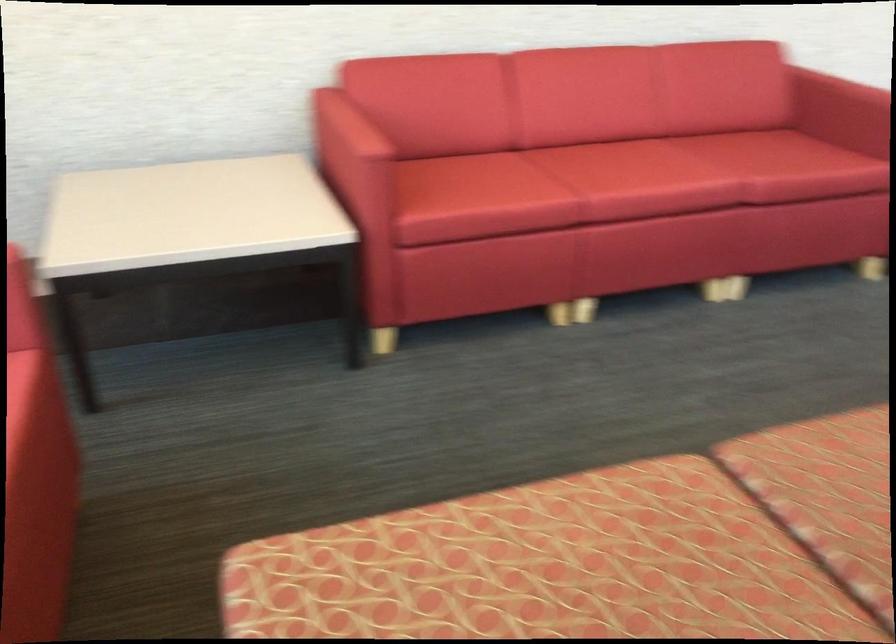
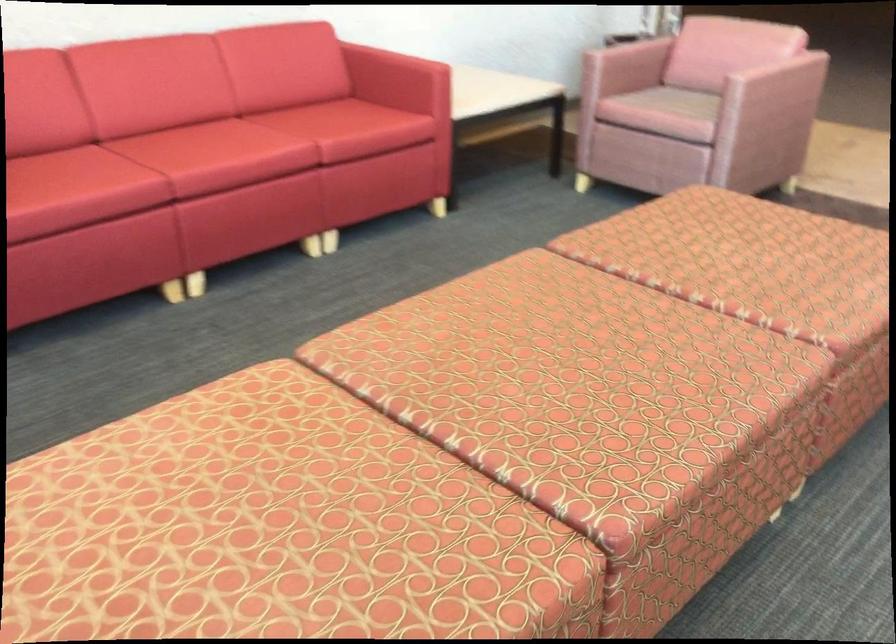
Find the pixel in the second image that matches point (616, 166) in the first image.

(196, 144)